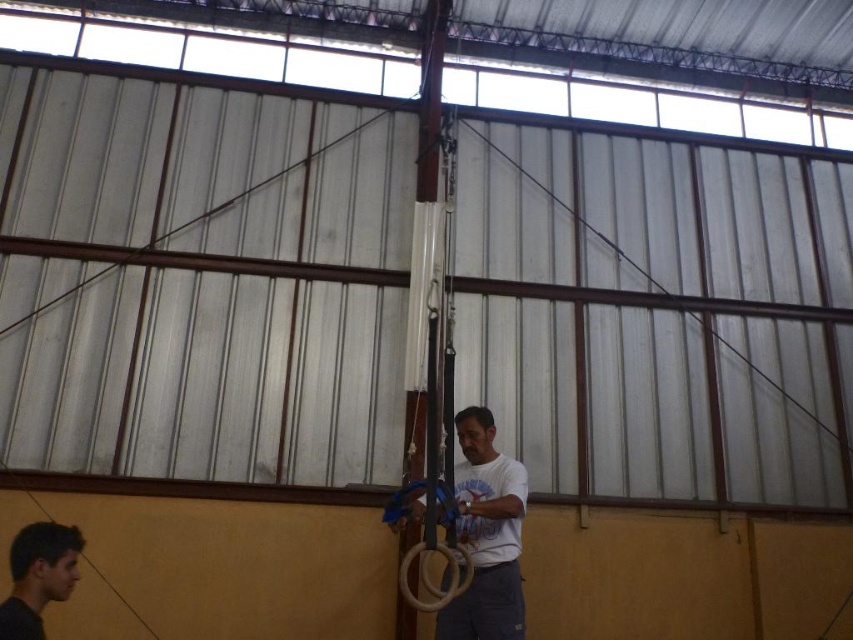
Question: Does white glossy pole at center have a larger size compared to white matte gymnastic rings at center?

Choices:
 (A) no
 (B) yes

Answer: (B)

Question: Which point is closer to the camera taking this photo?

Choices:
 (A) (454, 486)
 (B) (426, 289)
 (C) (3, 611)

Answer: (C)

Question: Which object appears closest to the camera in this image?

Choices:
 (A) white matte gymnastic rings at center
 (B) smooth skin face at lower left

Answer: (B)

Question: Can you confirm if white glossy pole at center is thinner than white matte gymnastic rings at center?

Choices:
 (A) no
 (B) yes

Answer: (B)

Question: Which is farther from the white matte gymnastic rings at center?

Choices:
 (A) white glossy pole at center
 (B) smooth skin face at lower left

Answer: (B)

Question: Does white glossy pole at center have a greater width compared to smooth skin face at lower left?

Choices:
 (A) yes
 (B) no

Answer: (A)